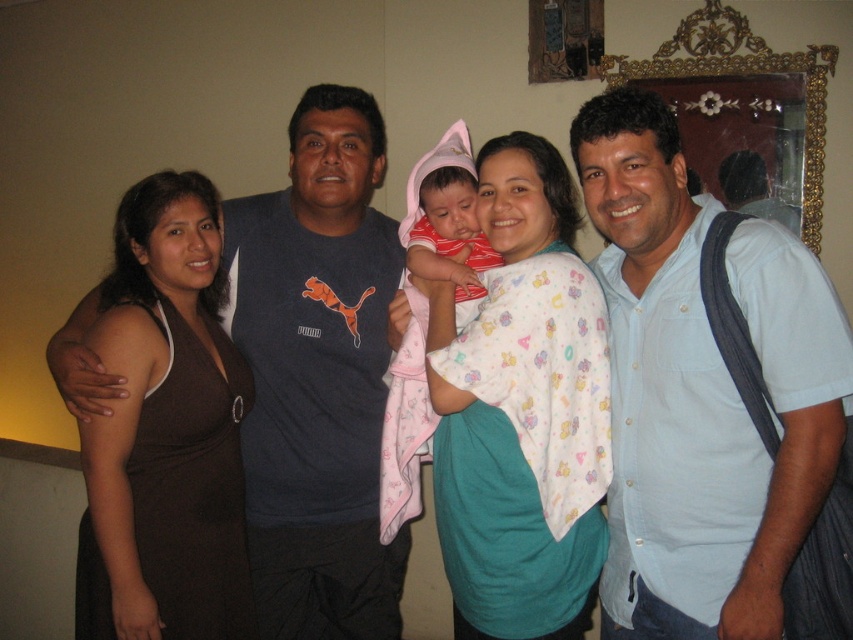
Question: Which point is farther from the camera taking this photo?

Choices:
 (A) (415, 413)
 (B) (422, 193)

Answer: (B)

Question: Which point is closer to the camera?

Choices:
 (A) (276, 452)
 (B) (646, 632)
 (C) (199, 186)
 (D) (408, 362)

Answer: (B)

Question: Which point is closer to the camera?

Choices:
 (A) (496, 545)
 (B) (202, 445)
 (C) (339, 224)
 (D) (769, 364)

Answer: (D)

Question: Is light blue shirt at center positioned in front of striped cotton shirt at center?

Choices:
 (A) no
 (B) yes

Answer: (B)

Question: Can you confirm if white cotton shirt at center is positioned above matte pink fabric baby at center?

Choices:
 (A) no
 (B) yes

Answer: (A)

Question: Is white cotton shirt at center positioned before striped cotton shirt at center?

Choices:
 (A) yes
 (B) no

Answer: (A)